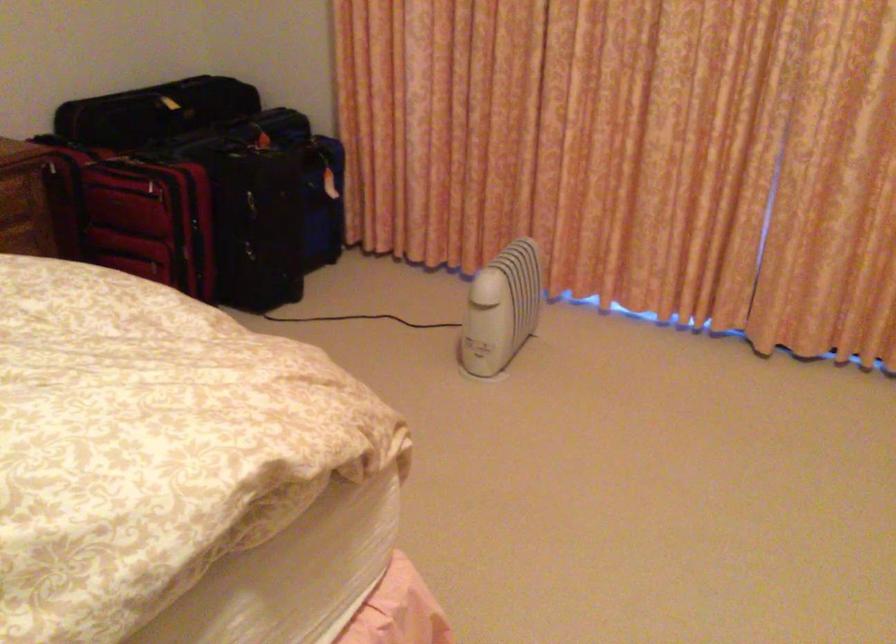
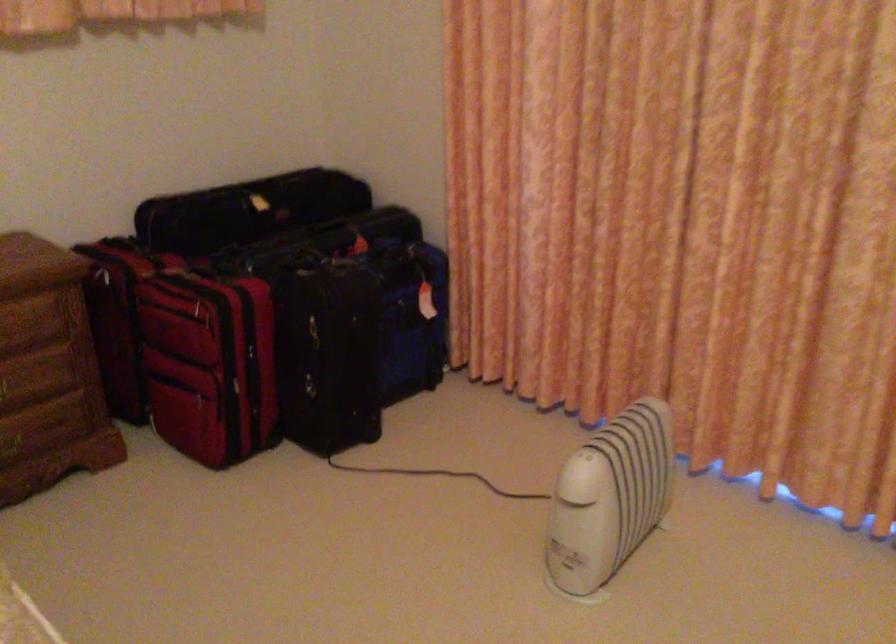
Question: The camera is either moving clockwise (left) or counter-clockwise (right) around the object. The first image is from the beginning of the video and the second image is from the end. Is the camera moving left or right when shooting the video?

Choices:
 (A) Left
 (B) Right

Answer: (B)